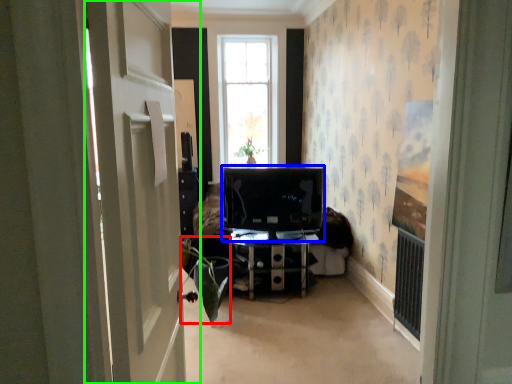
Question: Based on their relative distances, which object is farther from plant (highlighted by a red box)? Choose from computer monitor (highlighted by a blue box) and door (highlighted by a green box).

Choices:
 (A) computer monitor
 (B) door

Answer: (B)